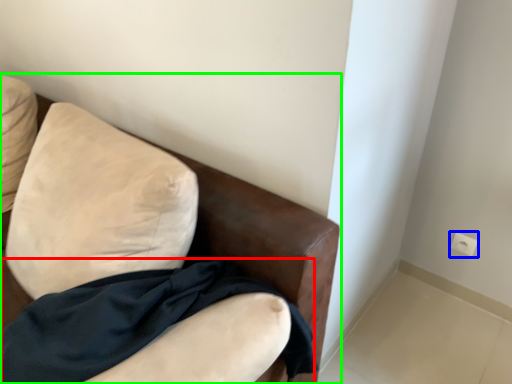
Question: Which object is positioned farthest from fabric (highlighted by a red box)? Select from electric outlet (highlighted by a blue box) and furniture (highlighted by a green box).

Choices:
 (A) electric outlet
 (B) furniture

Answer: (A)